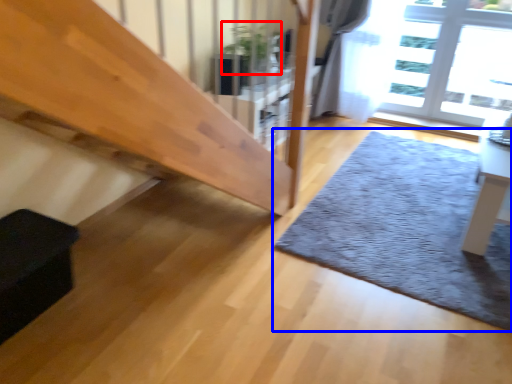
Question: Which of the following is the closest to the observer, plant (highlighted by a red box) or mat (highlighted by a blue box)?

Choices:
 (A) plant
 (B) mat

Answer: (B)